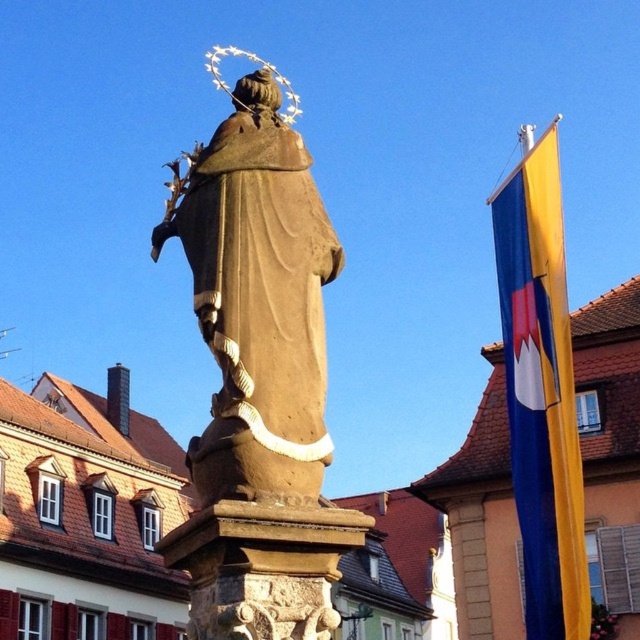
Looking at this image, you are standing in the town square where the statue is located. You see two points marked on the ground, point 1 at coordinates point (214, 429) and point 2 at coordinates point (528, 230). If you were to walk from the statue towards point 1, would you pass by point 2 first before reaching point 1?

Since point 1 is in front of point 2, you would reach point 1 before passing point 2. Therefore, you would not pass by point 2 first before reaching point 1.

You are a tourist in the town square and want to take a photo of the brown stone statue at center and the yellow fabric flag at right. If you stand in front of the statue, will the flag appear to your left or right in the photo?

The brown stone statue at center is positioned on the left side of yellow fabric flag at right. So, if you stand in front of the statue, the flag will appear to your right in the photo.